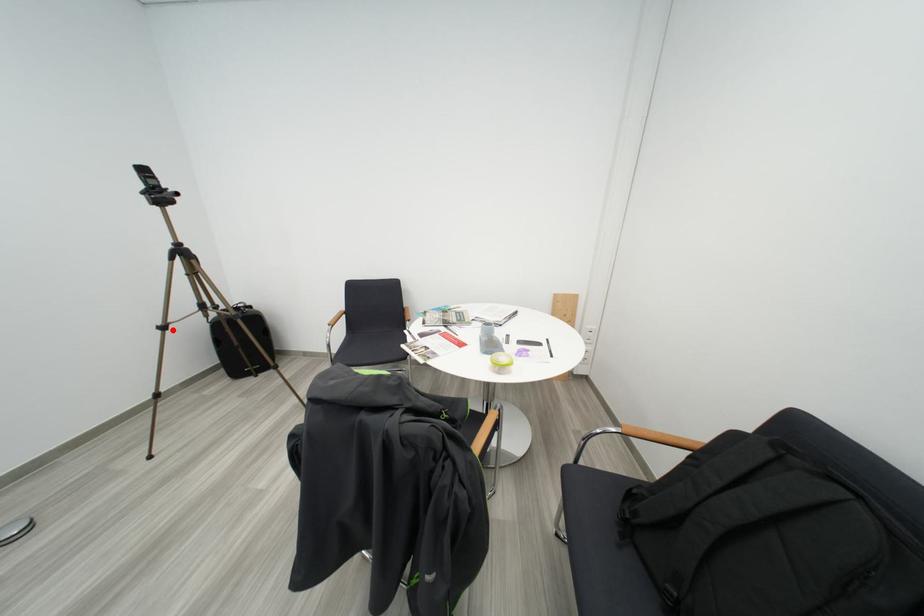
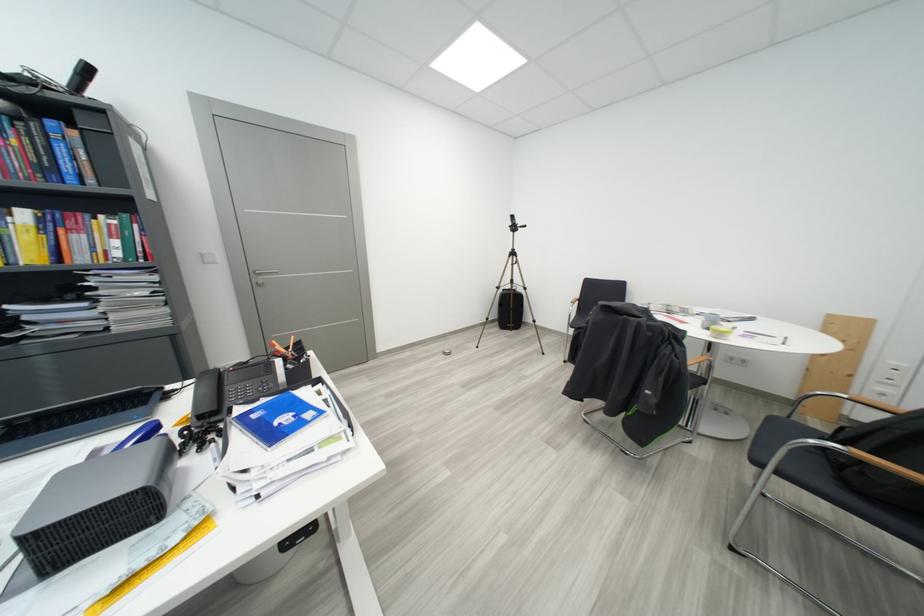
Question: I am providing you with two images of the same scene from different viewpoints. Given a red point in image1, look at the same physical point in image2. Is it:

Choices:
 (A) Closer to the viewpoint
 (B) Farther from the viewpoint

Answer: (A)